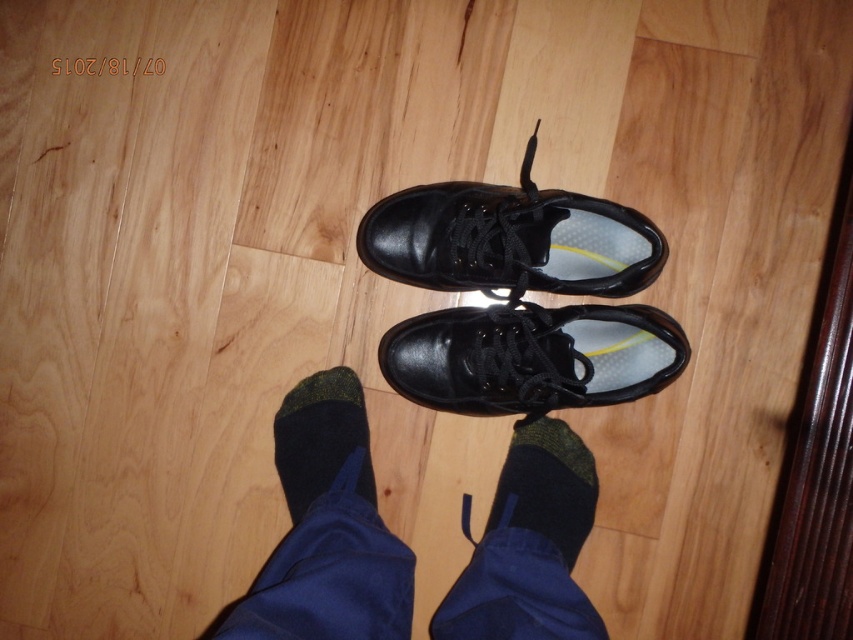
Who is more distant from viewer, (523, 260) or (521, 525)?

The point (521, 525) is behind.

Based on the photo, can you confirm if shiny black shoe at center is taller than dark green knit sock at lower center?

Yes, shiny black shoe at center is taller than dark green knit sock at lower center.

Who is more distant from viewer, (521,208) or (567,525)?

Positioned behind is point (567,525).

Identify the location of shiny black shoe at center. (509, 240).

Which is more to the right, shiny black shoe at center or dark green knit sock at center?

shiny black shoe at center is more to the right.

Who is more distant from viewer, (648, 221) or (349, 388)?

The point (349, 388) is more distant.

Who is more forward, (434, 198) or (289, 502)?

Point (289, 502) is more forward.

Locate an element on the screen. This screenshot has width=853, height=640. shiny black shoe at center is located at coordinates (509, 240).

Between point (613, 224) and point (416, 349), which one is positioned in front?

Point (613, 224)

Looking at this image, between shiny black shoe at center and black leather shoe at center, which one has less height?

black leather shoe at center

This screenshot has height=640, width=853. I want to click on shiny black shoe at center, so click(509, 240).